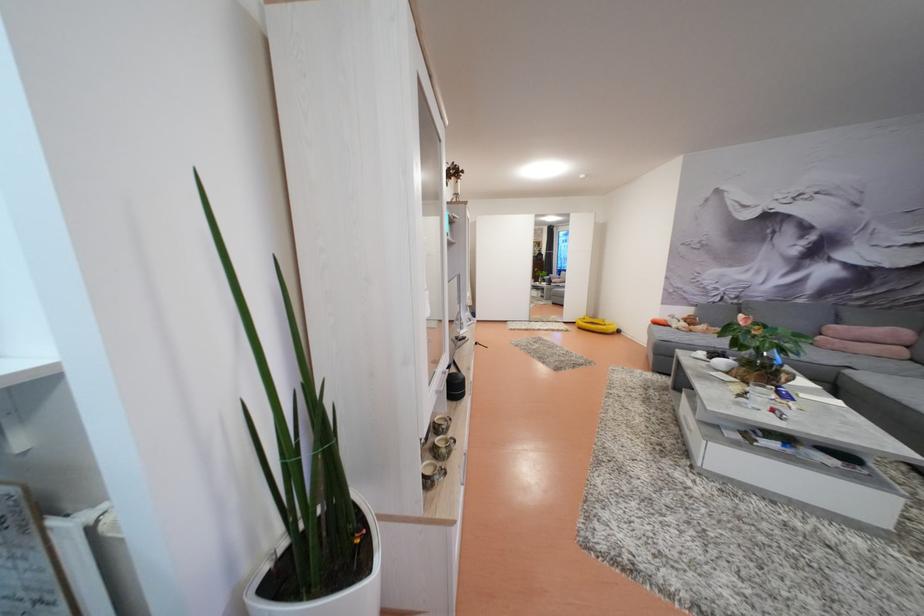
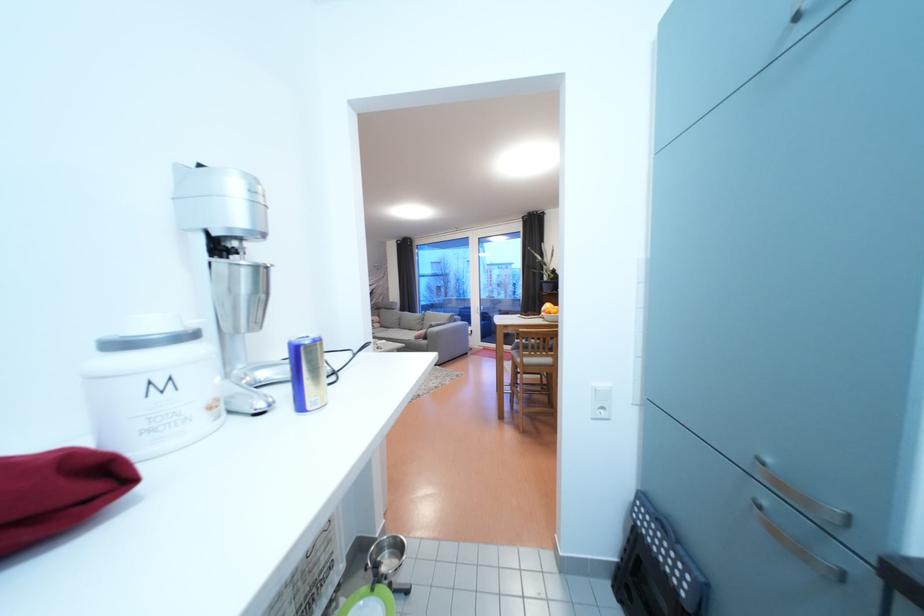
Question: I am providing you with two images of the same scene from different viewpoints. Which of the following objects are not visible in image2?

Choices:
 (A) white light switch
 (B) white paper object
 (C) metal cabinet handle
 (D) small patterned cup

Answer: (D)